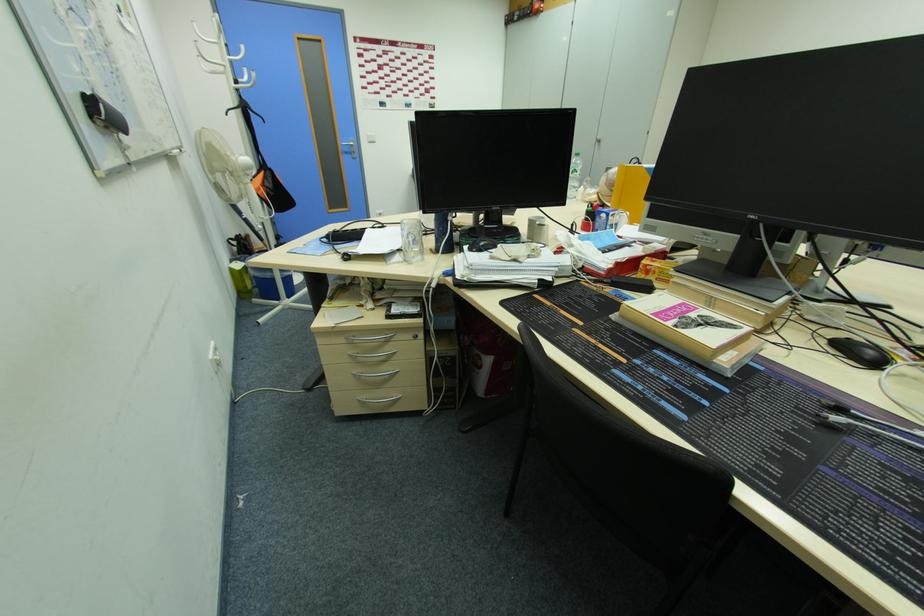
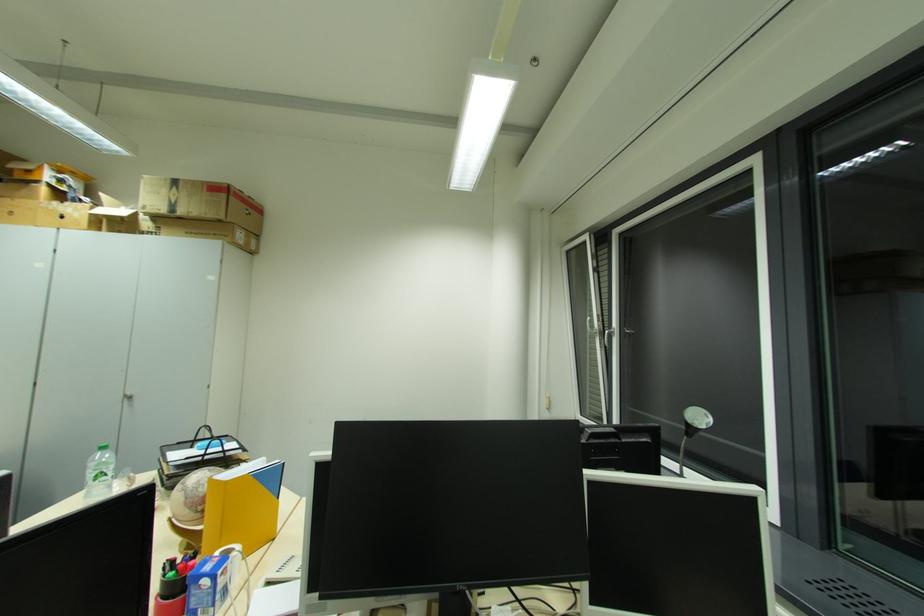
In the second image, find the point that corresponds to the point at 630,215 in the first image.

(242, 548)